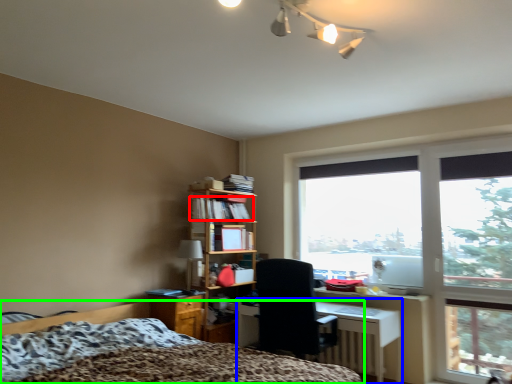
Question: Considering the real-world distances, which object is closest to book (highlighted by a red box)? desk (highlighted by a blue box) or bed (highlighted by a green box).

Choices:
 (A) desk
 (B) bed

Answer: (B)